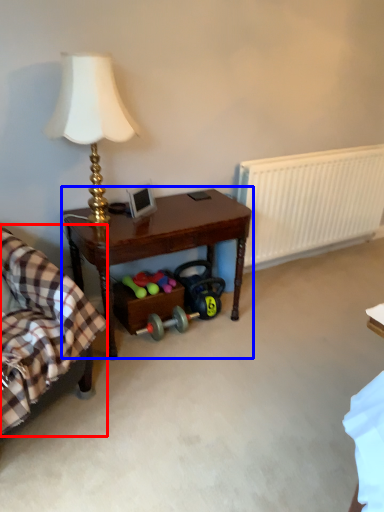
Question: Among these objects, which one is nearest to the camera, rocking chair (highlighted by a red box) or table (highlighted by a blue box)?

Choices:
 (A) rocking chair
 (B) table

Answer: (A)